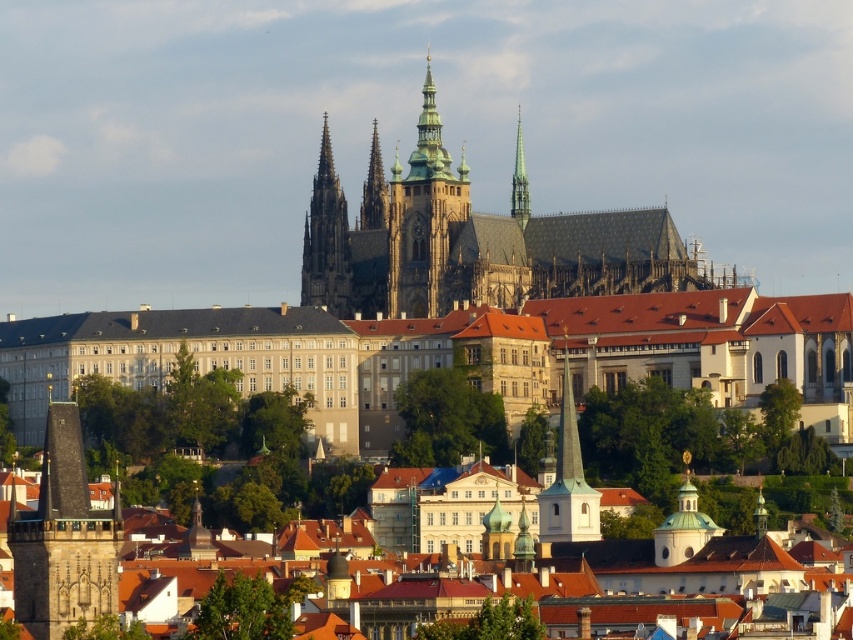
Who is taller, dark gray stone tower at left or white stone tower at center?

With more height is white stone tower at center.

Image resolution: width=853 pixels, height=640 pixels. Identify the location of dark gray stone tower at left. (62, 538).

Can you confirm if dark gray stone castle at center is positioned to the right of green stone tower at center?

Correct, you'll find dark gray stone castle at center to the right of green stone tower at center.

This screenshot has width=853, height=640. What do you see at coordinates (474, 243) in the screenshot? I see `dark gray stone castle at center` at bounding box center [474, 243].

Who is more distant from viewer, (665, 257) or (390, 202)?

The point (390, 202) is more distant.

At what (x,y) coordinates should I click in order to perform the action: click on dark gray stone castle at center. Please return your answer as a coordinate pair (x, y). The image size is (853, 640). Looking at the image, I should click on (474, 243).

Does dark gray stone tower at left appear under golden spire at center?

Indeed, dark gray stone tower at left is positioned under golden spire at center.

Image resolution: width=853 pixels, height=640 pixels. What do you see at coordinates (62, 538) in the screenshot?
I see `dark gray stone tower at left` at bounding box center [62, 538].

Looking at this image, who is more distant from viewer, (88,566) or (370,225)?

The point (370,225) is more distant.

Locate an element on the screen. This screenshot has width=853, height=640. dark gray stone tower at left is located at coordinates (62, 538).